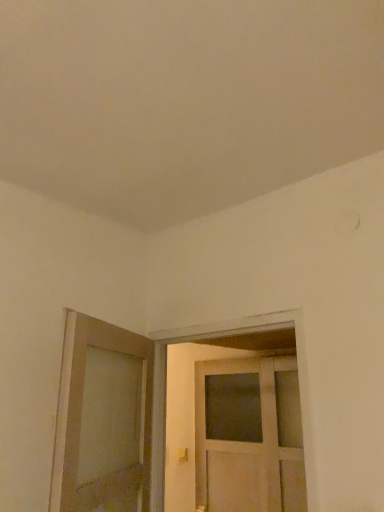
Question: Does matte gold door handle at lower center have a lesser width compared to white wooden door at center, the first door in the right-to-left sequence?

Choices:
 (A) yes
 (B) no

Answer: (A)

Question: Is matte gold door handle at lower center located outside white wooden door at center, the first door in the right-to-left sequence?

Choices:
 (A) yes
 (B) no

Answer: (A)

Question: Does matte gold door handle at lower center have a greater height compared to white wooden door at center, placed as the second door when sorted from left to right?

Choices:
 (A) yes
 (B) no

Answer: (B)

Question: From the image's perspective, is matte gold door handle at lower center located above white wooden door at center, placed as the second door when sorted from left to right?

Choices:
 (A) yes
 (B) no

Answer: (B)

Question: Is matte gold door handle at lower center shorter than white wooden door at center, the first door in the right-to-left sequence?

Choices:
 (A) yes
 (B) no

Answer: (A)

Question: Is matte gold door handle at lower center oriented towards white wooden door at center, the first door in the right-to-left sequence?

Choices:
 (A) yes
 (B) no

Answer: (B)

Question: Is there a large distance between matte wooden door at left, which is the 1th door in left-to-right order, and matte gold door handle at lower center?

Choices:
 (A) no
 (B) yes

Answer: (B)

Question: Considering the relative sizes of matte wooden door at left, which is the second door from right to left, and matte gold door handle at lower center in the image provided, is matte wooden door at left, which is the second door from right to left, smaller than matte gold door handle at lower center?

Choices:
 (A) yes
 (B) no

Answer: (B)

Question: Does matte wooden door at left, which is the second door from right to left, have a greater width compared to matte gold door handle at lower center?

Choices:
 (A) yes
 (B) no

Answer: (A)

Question: From the image's perspective, is matte wooden door at left, which is the second door from right to left, located beneath matte gold door handle at lower center?

Choices:
 (A) yes
 (B) no

Answer: (B)

Question: Is matte wooden door at left, which is the 1th door in left-to-right order, facing towards matte gold door handle at lower center?

Choices:
 (A) yes
 (B) no

Answer: (B)

Question: Does matte wooden door at left, which is the second door from right to left, have a larger size compared to matte gold door handle at lower center?

Choices:
 (A) yes
 (B) no

Answer: (A)

Question: Considering the relative positions of matte wooden door at left, which is the second door from right to left, and white wooden door at center, the first door in the right-to-left sequence, in the image provided, is matte wooden door at left, which is the second door from right to left, to the right of white wooden door at center, the first door in the right-to-left sequence, from the viewer's perspective?

Choices:
 (A) yes
 (B) no

Answer: (B)